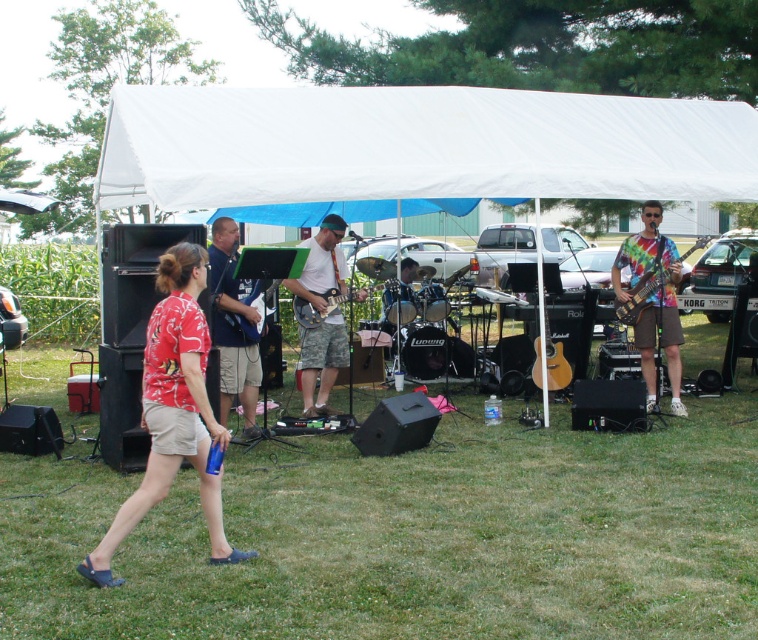
You are a photographer standing at the back of the tent. You need to capture a photo where both the white fabric canopy at upper center and the blue fabric shirt at center are visible. Which object will appear wider in the photo?

The white fabric canopy at upper center will appear wider in the photo because its width surpasses that of the blue fabric shirt at center.

You are a photographer at the outdoor music performance. You need to capture a photo that includes both the red floral shirt at lower left and the blue fabric shirt at center. Which shirt should you adjust your camera angle to focus on first to ensure both are in frame?

The red floral shirt at lower left is shorter than the blue fabric shirt at center, so you should focus on the blue fabric shirt at center first to ensure both are visible in the frame.